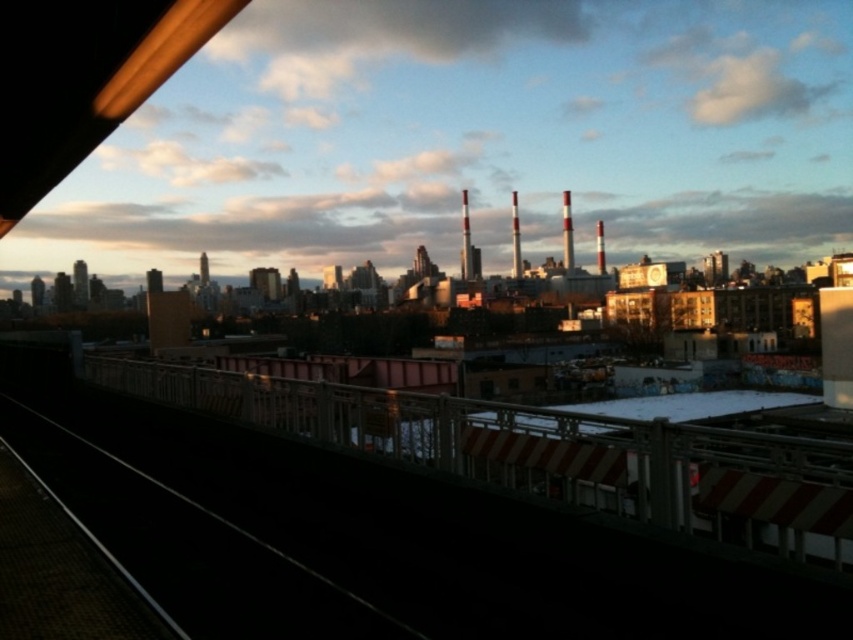
Question: Does matte gray sky at upper center appear under white metal rail at lower center?

Choices:
 (A) no
 (B) yes

Answer: (A)

Question: Does matte gray sky at upper center appear over white metal rail at lower center?

Choices:
 (A) no
 (B) yes

Answer: (B)

Question: Which point appears farthest from the camera in this image?

Choices:
 (A) tap(672, 451)
 (B) tap(363, 40)

Answer: (B)

Question: Can you confirm if matte gray sky at upper center is thinner than white metal rail at lower center?

Choices:
 (A) yes
 (B) no

Answer: (B)